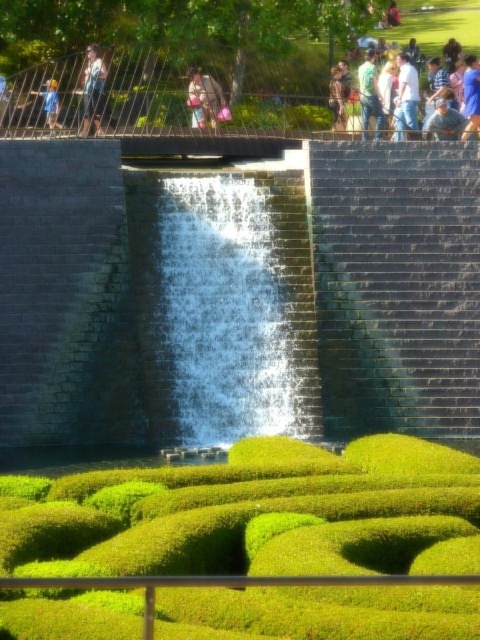
Question: Is white cotton shirt at upper center positioned at the back of green fabric shirt at upper center?

Choices:
 (A) yes
 (B) no

Answer: (A)

Question: Which object is the farthest from the green fabric shirt at upper center?

Choices:
 (A) green leafy hedge at center
 (B) white cotton shirt at upper center
 (C) clear water at center
 (D) dark gray brick wall at center

Answer: (A)

Question: Which point is closer to the camera taking this photo?

Choices:
 (A) click(x=57, y=122)
 (B) click(x=376, y=116)
 (C) click(x=92, y=88)

Answer: (A)

Question: Is white cotton shirt at upper center positioned at the back of green fabric shirt at upper center?

Choices:
 (A) no
 (B) yes

Answer: (B)

Question: Can you confirm if clear water at center is positioned to the right of blue shirt at upper right?

Choices:
 (A) no
 (B) yes

Answer: (A)

Question: Which of the following is the farthest from the observer?

Choices:
 (A) white cotton shirt at upper center
 (B) clear water at center
 (C) green leafy hedge at center

Answer: (A)